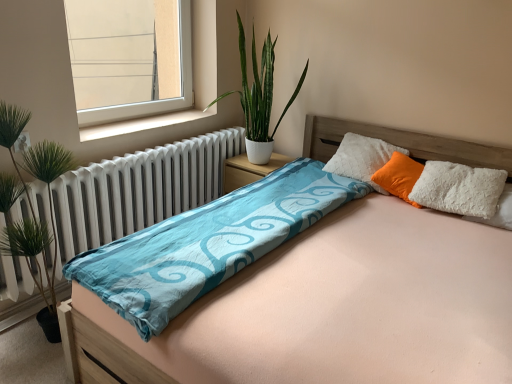
Question: From a real-world perspective, relative to orange soft pillow at upper right, is light pink fabric bed at center vertically above or below?

Choices:
 (A) below
 (B) above

Answer: (A)

Question: From the image's perspective, is light pink fabric bed at center located above or below orange soft pillow at upper right?

Choices:
 (A) below
 (B) above

Answer: (A)

Question: Estimate the real-world distances between objects in this image. Which object is closer to the white metallic radiator at left?

Choices:
 (A) light pink fabric bed at center
 (B) orange soft pillow at upper right
 (C) green leafy plant at left, the second vegetation positioned from the right
 (D) green glossy plant at upper center, the 1th vegetation viewed from the right
 (E) white smooth window sill at upper left

Answer: (E)

Question: Considering the real-world distances, which object is farthest from the transparent glass window at upper left?

Choices:
 (A) white smooth window sill at upper left
 (B) green glossy plant at upper center, the 1th vegetation viewed from the right
 (C) light pink fabric bed at center
 (D) green leafy plant at left, the first vegetation viewed from the left
 (E) white matte nightstand at center

Answer: (C)